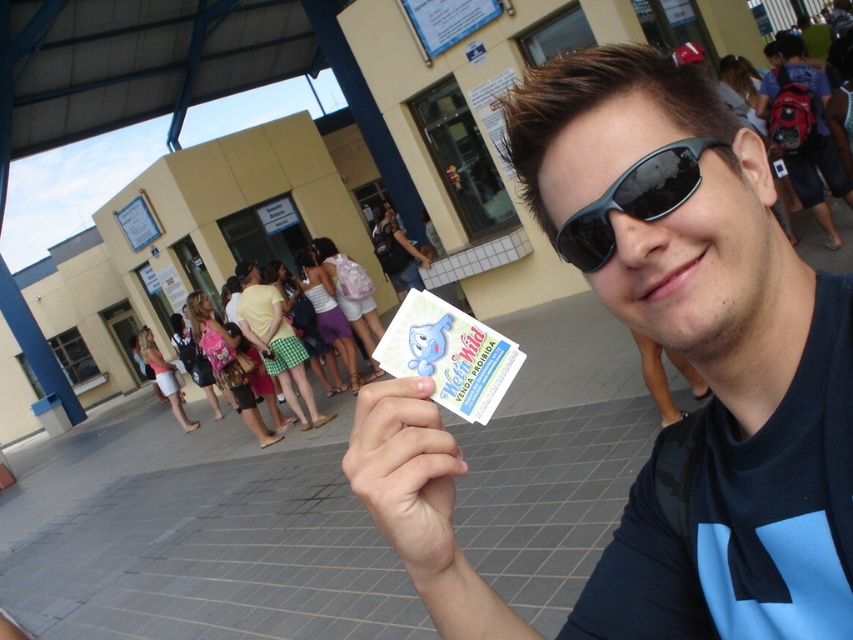
You are standing at the entrance of the building and want to reach the red backpack at right without getting too close to the black matte sunglasses at center. What is the minimum distance you need to walk?

The red backpack at right is 5.51 meters away from the black matte sunglasses at center. To avoid getting too close to the black matte sunglasses at center, you should walk around while maintaining a safe distance. The minimum distance you need to walk would depend on the path taken, but the straight line distance between them is 5.51 meters.

You are a photographer trying to capture a portrait of the person in the scene. You notice the matte black sunglasses at center and the white paper at center. Which object should you focus on first if you want to ensure both are in focus without adjusting the camera settings?

The matte black sunglasses at center has a greater height compared to the white paper at center, so focusing on the matte black sunglasses at center first would ensure both are in focus since it is larger and closer to the camera.